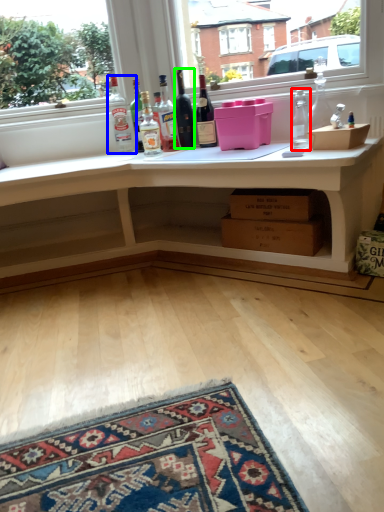
Question: Estimate the real-world distances between objects in this image. Which object is farther from bottle (highlighted by a red box), bottle (highlighted by a blue box) or bottle (highlighted by a green box)?

Choices:
 (A) bottle
 (B) bottle

Answer: (A)